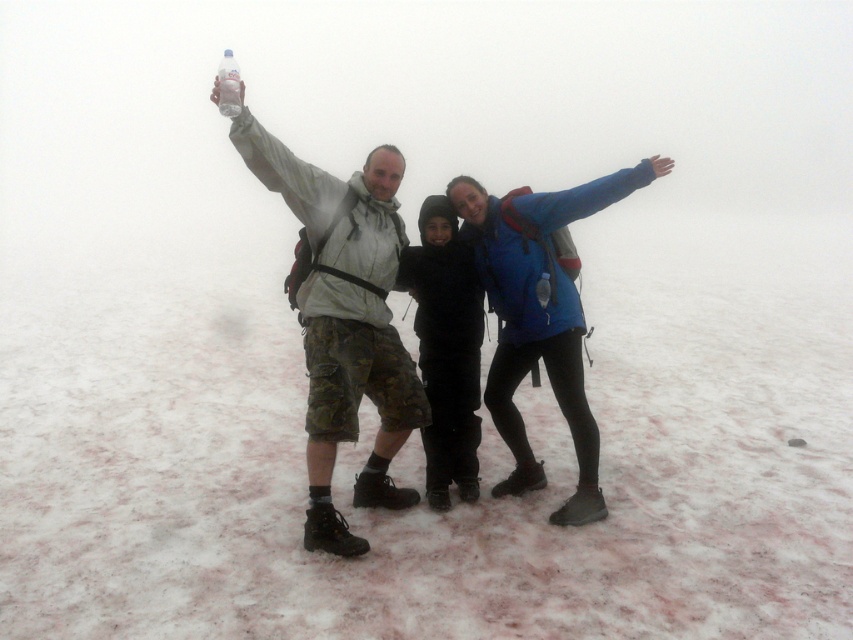
Question: Which point is farther from the camera taking this photo?

Choices:
 (A) (74, 520)
 (B) (303, 202)

Answer: (A)

Question: Can you confirm if white fluffy snow at center is positioned to the right of blue matte jacket at center?

Choices:
 (A) no
 (B) yes

Answer: (A)

Question: Is white fluffy snow at center smaller than blue matte jacket at center?

Choices:
 (A) no
 (B) yes

Answer: (A)

Question: Among these objects, which one is farthest from the camera?

Choices:
 (A) blue matte jacket at center
 (B) matte gray jacket at center

Answer: (A)

Question: Which point is farther to the camera?

Choices:
 (A) matte gray jacket at center
 (B) blue matte jacket at center
 (C) white fluffy snow at center

Answer: (B)

Question: Can you confirm if white fluffy snow at center is smaller than blue matte jacket at center?

Choices:
 (A) yes
 (B) no

Answer: (B)